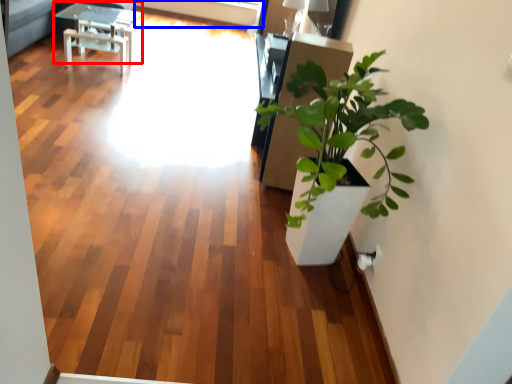
Question: Among these objects, which one is farthest to the camera, table (highlighted by a red box) or window screen (highlighted by a blue box)?

Choices:
 (A) table
 (B) window screen

Answer: (B)